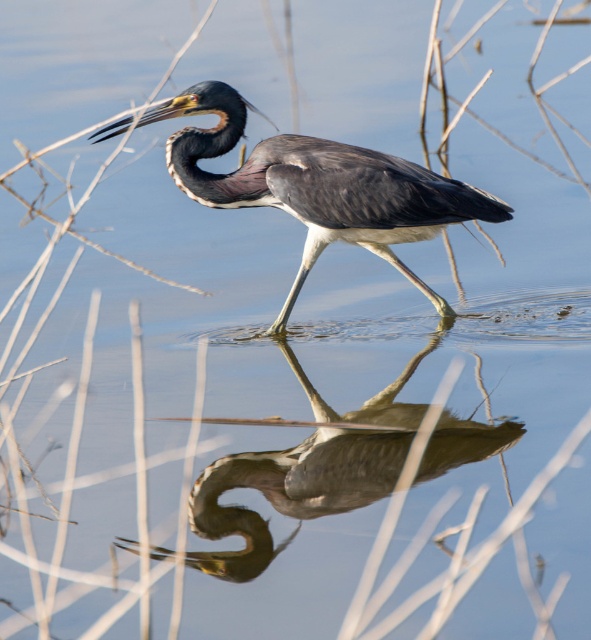
Question: Which object appears farthest from the camera in this image?

Choices:
 (A) smooth gray heron at center
 (B) brown feathered heron at center

Answer: (B)

Question: Can you confirm if brown feathered heron at center is bigger than smooth gray heron at center?

Choices:
 (A) yes
 (B) no

Answer: (A)

Question: Does brown feathered heron at center lie in front of smooth gray heron at center?

Choices:
 (A) yes
 (B) no

Answer: (B)

Question: Is brown feathered heron at center to the right of smooth gray heron at center from the viewer's perspective?

Choices:
 (A) yes
 (B) no

Answer: (B)